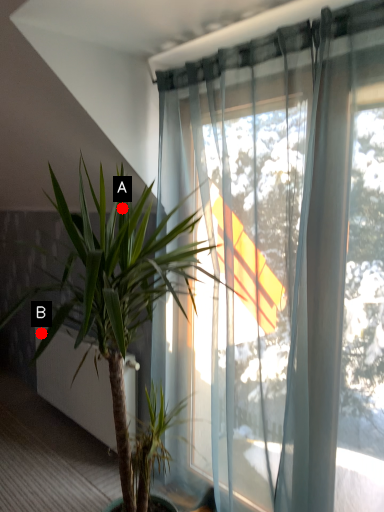
Question: Two points are circled on the image, labeled by A and B beside each circle. Which of the following is the farthest from the observer?

Choices:
 (A) A is further
 (B) B is further

Answer: (B)